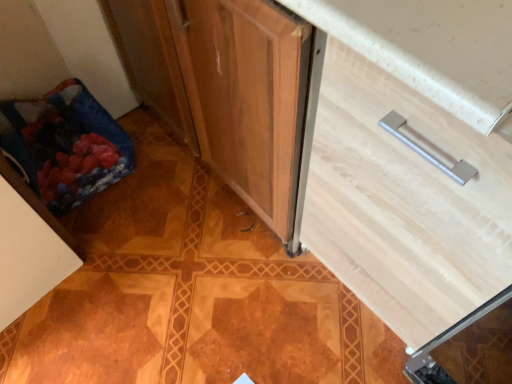
Question: Is blue fabric bag at lower left taller or shorter than light wood drawer at center?

Choices:
 (A) short
 (B) tall

Answer: (A)

Question: From the image's perspective, is blue fabric bag at lower left above or below light wood drawer at center?

Choices:
 (A) below
 (B) above

Answer: (B)

Question: Which object is the closest to the white matte cabinet at lower left?

Choices:
 (A) blue fabric bag at lower left
 (B) light wood drawer at center

Answer: (A)

Question: Estimate the real-world distances between objects in this image. Which object is farther from the blue fabric bag at lower left?

Choices:
 (A) white matte cabinet at lower left
 (B) light wood drawer at center

Answer: (B)